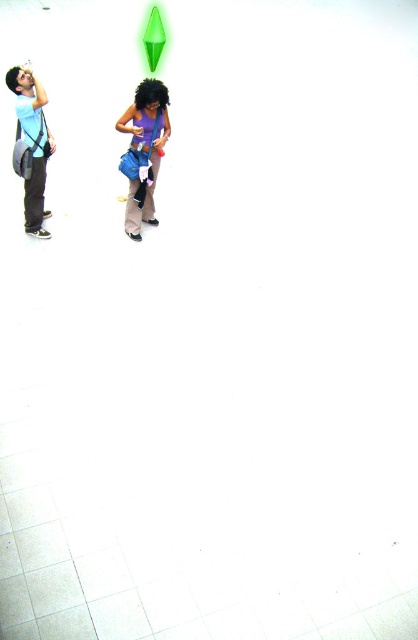
You are standing at the center of the image and want to find the matte purple shirt at center. According to the coordinates provided, in which direction should you look to locate it?

The matte purple shirt at center is located at coordinates point [143,150], which means you should look to the left from the center to find it.